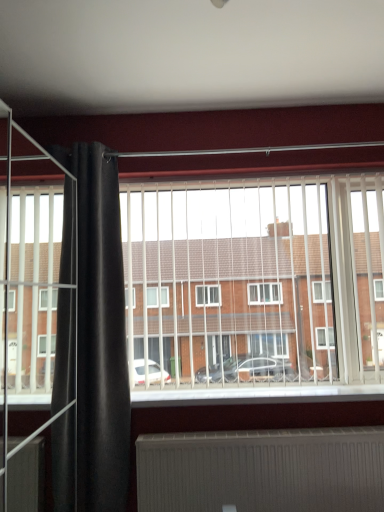
Locate an element on the screen. Image resolution: width=384 pixels, height=512 pixels. black velvet curtain at left is located at coordinates (100, 333).

Where is `white ribbed radiator at lower center`? The height and width of the screenshot is (512, 384). white ribbed radiator at lower center is located at coordinates (262, 471).

Considering the sizes of white plastic blinds at center and black velvet curtain at left in the image, is white plastic blinds at center taller or shorter than black velvet curtain at left?

Considering their sizes, white plastic blinds at center has less height than black velvet curtain at left.

From a real-world perspective, is white plastic blinds at center above or below black velvet curtain at left?

white plastic blinds at center is situated higher than black velvet curtain at left in the real world.

Considering the relative sizes of white plastic blinds at center and black velvet curtain at left in the image provided, is white plastic blinds at center wider than black velvet curtain at left?

No, white plastic blinds at center is not wider than black velvet curtain at left.

Does white plastic blinds at center appear on the right side of black velvet curtain at left?

Indeed, white plastic blinds at center is positioned on the right side of black velvet curtain at left.

Does black velvet curtain at left appear on the left side of white ribbed radiator at lower center?

Indeed, black velvet curtain at left is positioned on the left side of white ribbed radiator at lower center.

What's the angular difference between black velvet curtain at left and white ribbed radiator at lower center's facing directions?

There is a 1.6-degree angle between the facing directions of black velvet curtain at left and white ribbed radiator at lower center.

Considering their positions, is black velvet curtain at left located in front of or behind white ribbed radiator at lower center?

Clearly, black velvet curtain at left is in front of white ribbed radiator at lower center.

Considering the sizes of black velvet curtain at left and white ribbed radiator at lower center in the image, is black velvet curtain at left wider or thinner than white ribbed radiator at lower center?

Clearly, black velvet curtain at left has more width compared to white ribbed radiator at lower center.

Looking at this image, is black velvet curtain at left positioned with its back to white plastic blinds at center?

No, black velvet curtain at left is not facing away from white plastic blinds at center.

How many degrees apart are the facing directions of black velvet curtain at left and white plastic blinds at center?

1.93 degrees separate the facing orientations of black velvet curtain at left and white plastic blinds at center.

Can you confirm if black velvet curtain at left is thinner than white plastic blinds at center?

No.

Does black velvet curtain at left have a lesser height compared to white plastic blinds at center?

No, black velvet curtain at left is not shorter than white plastic blinds at center.

From a real-world perspective, which object rests below the other?

From a 3D spatial view, white ribbed radiator at lower center is below.

Is white ribbed radiator at lower center closer to camera compared to white plastic blinds at center?

That is True.

In the scene shown: Considering the sizes of white ribbed radiator at lower center and white plastic blinds at center in the image, is white ribbed radiator at lower center taller or shorter than white plastic blinds at center?

white ribbed radiator at lower center is shorter than white plastic blinds at center.

From the image's perspective, is white plastic blinds at center below white ribbed radiator at lower center?

No.

Are white plastic blinds at center and white ribbed radiator at lower center making contact?

white plastic blinds at center is not next to white ribbed radiator at lower center, and they're not touching.

From a real-world perspective, who is located higher, white plastic blinds at center or white ribbed radiator at lower center?

white plastic blinds at center, from a real-world perspective.

Between white plastic blinds at center and white ribbed radiator at lower center, which one has smaller width?

With smaller width is white ribbed radiator at lower center.

From a real-world perspective, is white ribbed radiator at lower center physically below black velvet curtain at left?

Yes.

Is point (356, 455) positioned behind point (111, 382)?

No, it is not.

Find the location of a particular element. This screenshot has width=384, height=512. radiator below the black velvet curtain at left (from a real-world perspective) is located at coordinates (262, 471).

Find the location of a particular element. shower curtain below the white plastic blinds at center (from a real-world perspective) is located at coordinates (100, 333).

Where is `shower curtain above the white ribbed radiator at lower center (from a real-world perspective)`? The width and height of the screenshot is (384, 512). shower curtain above the white ribbed radiator at lower center (from a real-world perspective) is located at coordinates (100, 333).

From the image, which object appears to be farther from black velvet curtain at left, white ribbed radiator at lower center or white plastic blinds at center?

white ribbed radiator at lower center.

Estimate the real-world distances between objects in this image. Which object is closer to white ribbed radiator at lower center, black velvet curtain at left or white plastic blinds at center?

white plastic blinds at center.

Based on the photo, when comparing their distances from white ribbed radiator at lower center, does white plastic blinds at center or black velvet curtain at left seem closer?

white plastic blinds at center lies closer to white ribbed radiator at lower center than the other object.

Considering their positions, is white plastic blinds at center positioned further to black velvet curtain at left than white ribbed radiator at lower center?

white ribbed radiator at lower center is further to black velvet curtain at left.

Considering their positions, is black velvet curtain at left positioned further to white plastic blinds at center than white ribbed radiator at lower center?

white ribbed radiator at lower center is positioned further to the anchor white plastic blinds at center.

When comparing their distances from white plastic blinds at center, does white ribbed radiator at lower center or black velvet curtain at left seem further?

white ribbed radiator at lower center.

Locate an element on the screen. Image resolution: width=384 pixels, height=512 pixels. radiator between black velvet curtain at left and white plastic blinds at center is located at coordinates (262, 471).